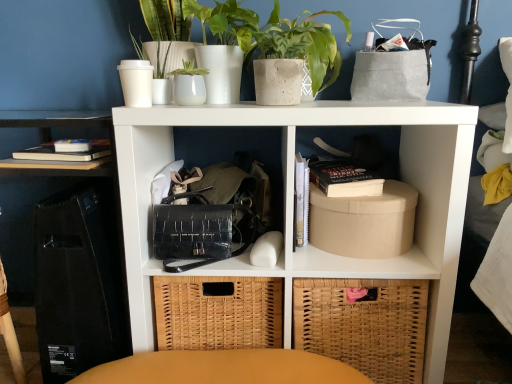
Question: Would you say woven brown basket at lower right is part of hardcover books at left, which appears as the 1th shelf when viewed from the top,'s contents?

Choices:
 (A) no
 (B) yes

Answer: (A)

Question: Is hardcover books at left, the 2th shelf in the right-to-left sequence, wider than woven brown basket at lower right?

Choices:
 (A) no
 (B) yes

Answer: (A)

Question: Does hardcover books at left, acting as the second shelf starting from the bottom, have a larger size compared to woven brown basket at lower right?

Choices:
 (A) yes
 (B) no

Answer: (B)

Question: Is hardcover books at left, the 2th shelf in the right-to-left sequence, shorter than woven brown basket at lower right?

Choices:
 (A) no
 (B) yes

Answer: (B)

Question: Is woven brown basket at lower right at the back of hardcover books at left, acting as the second shelf starting from the bottom?

Choices:
 (A) no
 (B) yes

Answer: (A)

Question: From the image's perspective, is hardcover books at left, which appears as the 1th shelf when viewed from the top, on top of woven brown basket at lower right?

Choices:
 (A) yes
 (B) no

Answer: (A)

Question: From a real-world perspective, is white matte shelf at center, placed as the first shelf when sorted from bottom to top, on speckled concrete pot at upper center?

Choices:
 (A) no
 (B) yes

Answer: (A)

Question: Is white matte shelf at center, the second shelf from the top, oriented towards speckled concrete pot at upper center?

Choices:
 (A) yes
 (B) no

Answer: (B)

Question: Is white matte shelf at center, which is the 2th shelf from left to right, outside speckled concrete pot at upper center?

Choices:
 (A) yes
 (B) no

Answer: (A)

Question: Is white matte shelf at center, which is the 2th shelf from left to right, far from speckled concrete pot at upper center?

Choices:
 (A) yes
 (B) no

Answer: (B)

Question: Does white matte shelf at center, placed as the first shelf when sorted from bottom to top, have a lesser height compared to speckled concrete pot at upper center?

Choices:
 (A) yes
 (B) no

Answer: (B)

Question: Does white matte shelf at center, the second shelf from the top, have a lesser width compared to speckled concrete pot at upper center?

Choices:
 (A) yes
 (B) no

Answer: (B)

Question: Considering the relative sizes of black crocodile-patterned handbag at center and beige cardboard box at right in the image provided, is black crocodile-patterned handbag at center smaller than beige cardboard box at right?

Choices:
 (A) no
 (B) yes

Answer: (A)